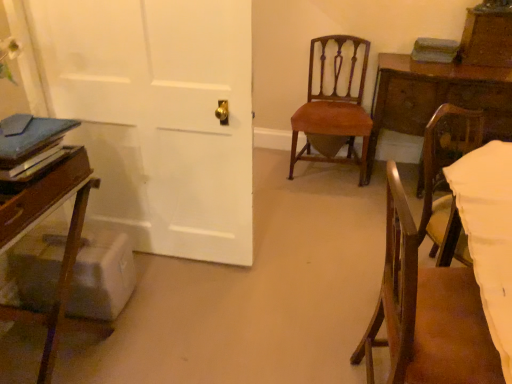
Question: Would you say wooden chair at left, the 3th chair viewed from the right, is to the left or to the right of wooden chair at lower right, marked as the 1th chair in a front-to-back arrangement, in the picture?

Choices:
 (A) right
 (B) left

Answer: (B)

Question: Is wooden chair at left, which is the 1th chair from left to right, taller or shorter than wooden chair at lower right, marked as the 1th chair in a front-to-back arrangement?

Choices:
 (A) short
 (B) tall

Answer: (A)

Question: Which of these objects is positioned farthest from the wooden chair at lower right, the 3th chair viewed from the back?

Choices:
 (A) wooden chair at left, positioned as the second chair in back-to-front order
 (B) brown wood drawer at left
 (C) wooden table at right
 (D) velvet orange chair at center, arranged as the 3th chair when viewed from the front

Answer: (D)

Question: Which of these objects is positioned farthest from the brown wood drawer at left?

Choices:
 (A) wooden table at right
 (B) velvet orange chair at center, the first chair when ordered from back to front
 (C) wooden chair at lower right, the 3th chair viewed from the back
 (D) wooden chair at left, the second chair in the front-to-back sequence

Answer: (A)